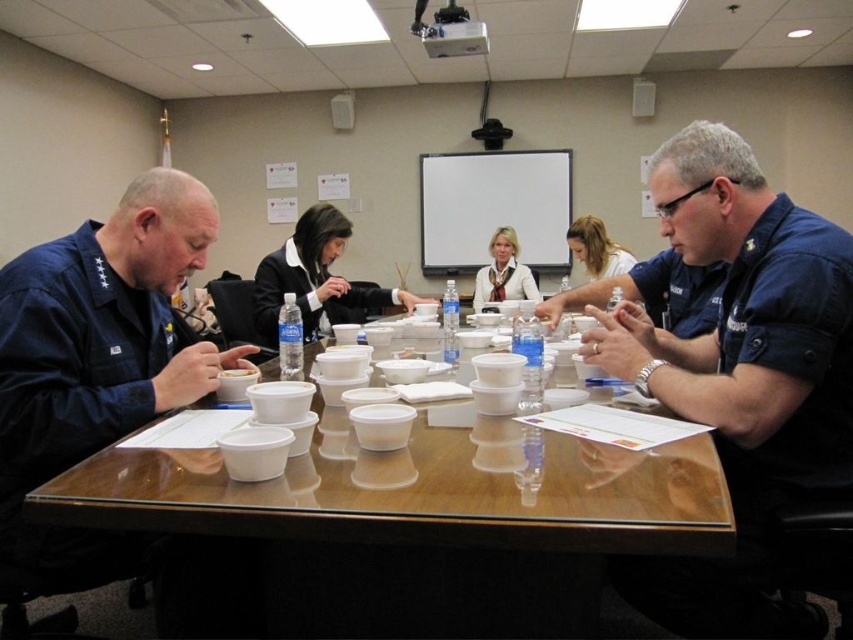
Does wooden table at center have a lesser height compared to blonde hair at upper center?

No.

Does point (546, 445) come in front of point (621, 248)?

Yes.

Locate an element on the screen. Image resolution: width=853 pixels, height=640 pixels. wooden table at center is located at coordinates (401, 531).

From the picture: Does wooden table at center lie behind black fabric jacket at center?

No.

Does point (401, 611) lie in front of point (337, 284)?

Yes, it is in front of point (337, 284).

Describe the element at coordinates (401, 531) in the screenshot. I see `wooden table at center` at that location.

In order to click on wooden table at center in this screenshot , I will do `click(401, 531)`.

Is wooden table at center bigger than matte white blouse at center?

No.

Who is shorter, wooden table at center or matte white blouse at center?

wooden table at center

Identify the location of wooden table at center. (401, 531).